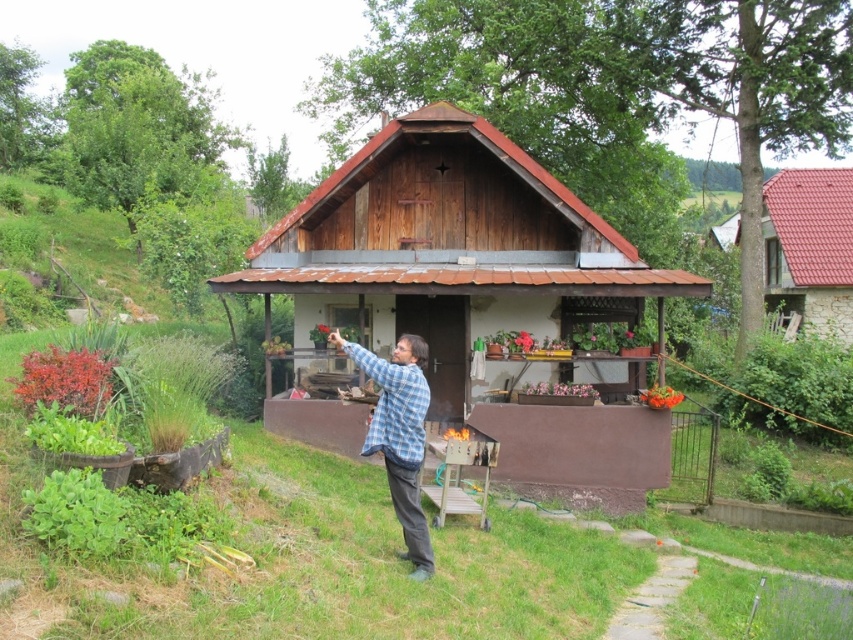
You are planning to build a new shed in your backyard. The wooden cabin at center and the red tile roof at upper right are examples of structures you are considering. Based on the image, which structure has a larger footprint in terms of width?

The wooden cabin at center might be wider than red tile roof at upper right, so the wooden cabin at center likely has a larger footprint in terms of width.

You are standing at the center of the image and want to walk to the green grass at lower center. What are the coordinates you need to move towards?

The coordinates to move towards the green grass at lower center are point (312,557).